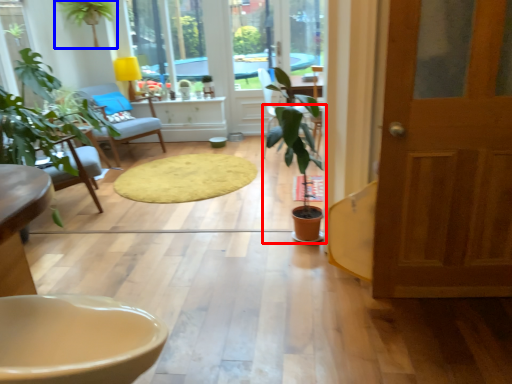
Question: Which object is closer to the camera taking this photo, houseplant (highlighted by a red box) or houseplant (highlighted by a blue box)?

Choices:
 (A) houseplant
 (B) houseplant

Answer: (A)